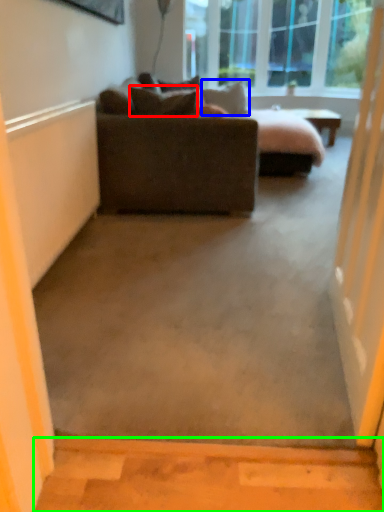
Question: Which object is positioned closest to pillow (highlighted by a red box)? Select from pillow (highlighted by a blue box) and concrete (highlighted by a green box).

Choices:
 (A) pillow
 (B) concrete

Answer: (A)